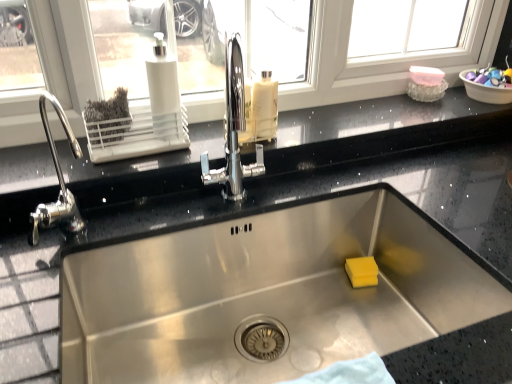
Question: Can you confirm if translucent plastic bottle at center is thinner than black granite countertop at upper center?

Choices:
 (A) no
 (B) yes

Answer: (B)

Question: Considering the relative sizes of translucent plastic bottle at center and black granite countertop at upper center in the image provided, is translucent plastic bottle at center bigger than black granite countertop at upper center?

Choices:
 (A) yes
 (B) no

Answer: (B)

Question: Can you confirm if translucent plastic bottle at center is positioned to the right of black granite countertop at upper center?

Choices:
 (A) yes
 (B) no

Answer: (B)

Question: Considering the relative positions of translucent plastic bottle at center and black granite countertop at upper center in the image provided, is translucent plastic bottle at center in front of black granite countertop at upper center?

Choices:
 (A) no
 (B) yes

Answer: (A)

Question: Is translucent plastic bottle at center at the left side of black granite countertop at upper center?

Choices:
 (A) yes
 (B) no

Answer: (A)

Question: From their relative heights in the image, would you say black granite countertop at upper center is taller or shorter than white plastic soap dispenser at upper left?

Choices:
 (A) tall
 (B) short

Answer: (B)

Question: In the image, is black granite countertop at upper center positioned in front of or behind white plastic soap dispenser at upper left?

Choices:
 (A) behind
 (B) front

Answer: (B)

Question: Considering the positions of black granite countertop at upper center and white plastic soap dispenser at upper left in the image, is black granite countertop at upper center wider or thinner than white plastic soap dispenser at upper left?

Choices:
 (A) thin
 (B) wide

Answer: (B)

Question: From the image's perspective, is black granite countertop at upper center positioned above or below white plastic soap dispenser at upper left?

Choices:
 (A) below
 (B) above

Answer: (A)

Question: Is point (437, 109) closer or farther from the camera than point (465, 89)?

Choices:
 (A) farther
 (B) closer

Answer: (A)

Question: Is black granite countertop at upper center situated inside plastic bowl at upper right or outside?

Choices:
 (A) inside
 (B) outside

Answer: (B)

Question: In terms of size, does black granite countertop at upper center appear bigger or smaller than plastic bowl at upper right?

Choices:
 (A) small
 (B) big

Answer: (B)

Question: Looking at their shapes, would you say black granite countertop at upper center is wider or thinner than plastic bowl at upper right?

Choices:
 (A) wide
 (B) thin

Answer: (A)

Question: In terms of size, does translucent plastic bottle at center appear bigger or smaller than white plastic soap dispenser at upper left?

Choices:
 (A) big
 (B) small

Answer: (A)

Question: Would you say translucent plastic bottle at center is inside or outside white plastic soap dispenser at upper left?

Choices:
 (A) outside
 (B) inside

Answer: (A)